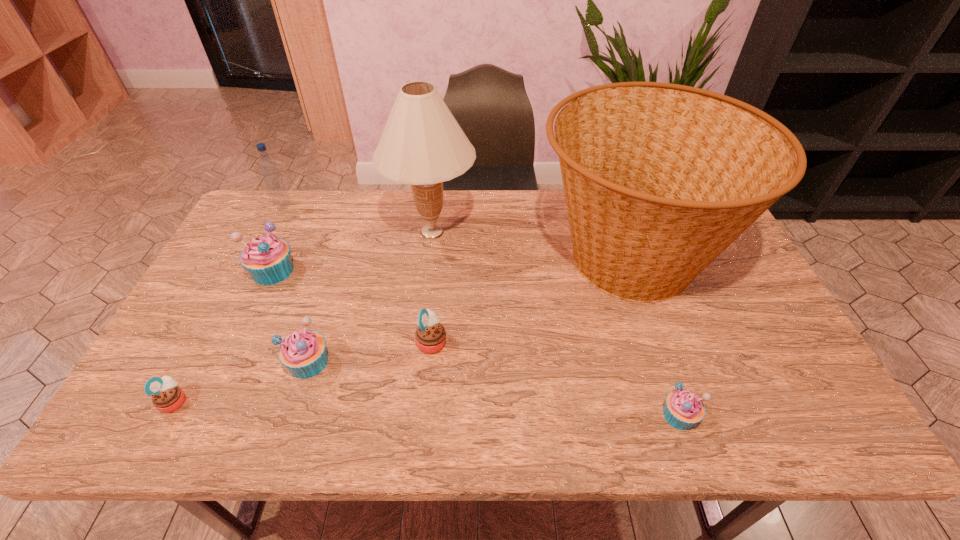
This screenshot has height=540, width=960. In order to click on lampshade in this screenshot , I will do `click(422, 144)`.

I want to click on basket, so click(x=659, y=179).

The height and width of the screenshot is (540, 960). In order to click on water bottle in this screenshot , I will do `click(269, 169)`.

Image resolution: width=960 pixels, height=540 pixels. In order to click on blue water bottle in this screenshot , I will do `click(269, 169)`.

Where is `the leftmost blue muffin`? the leftmost blue muffin is located at coordinates (267, 258).

Find the location of a particular element. The image size is (960, 540). the fourth tallest object is located at coordinates (267, 258).

Locate an element on the screen. The height and width of the screenshot is (540, 960). the farther pink muffin is located at coordinates (430, 336).

Where is `the right pink muffin`? the right pink muffin is located at coordinates (430, 336).

Where is `the second nearest blue muffin`? The image size is (960, 540). the second nearest blue muffin is located at coordinates (303, 352).

Locate an element on the screen. the fourth object from left to right is located at coordinates (303, 352).